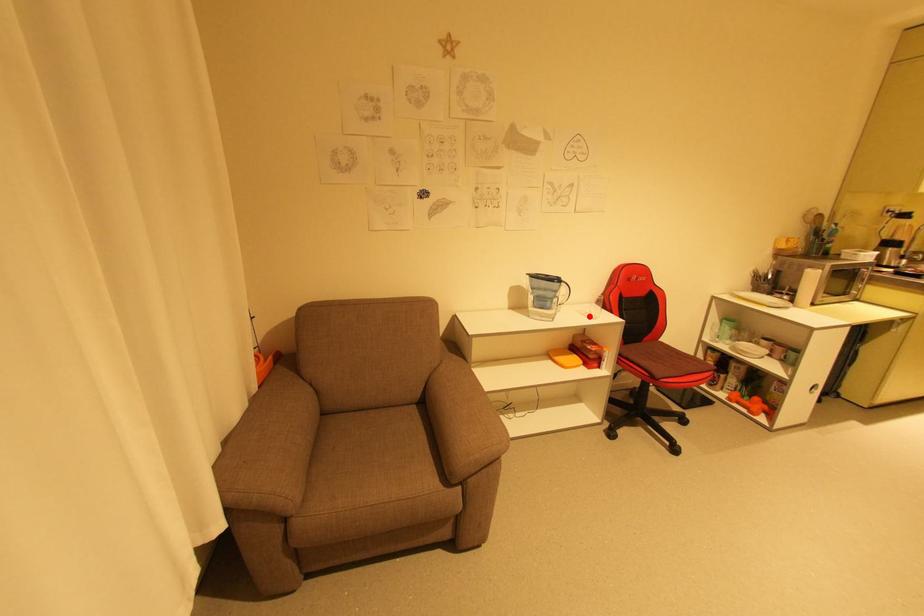
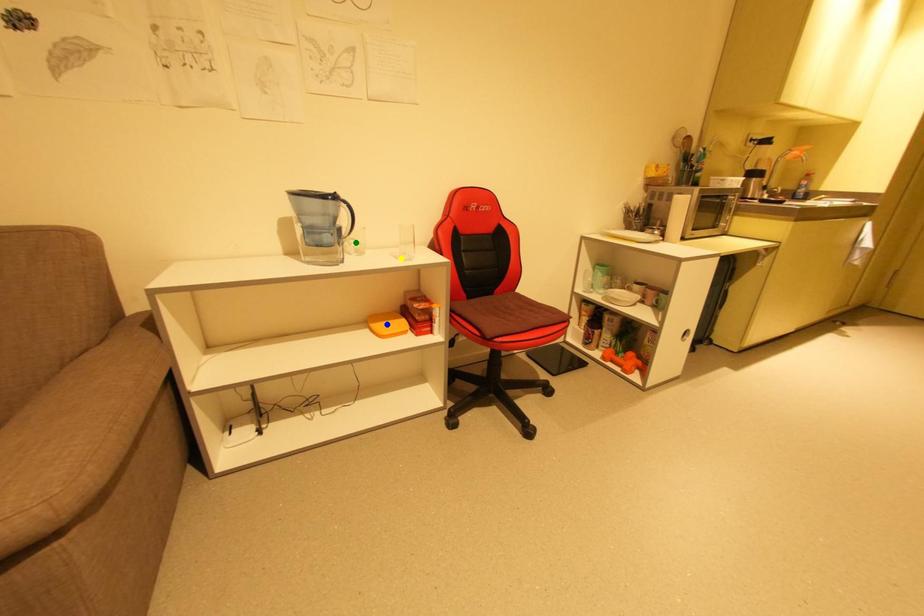
Question: I am providing you with two images of the same scene from different viewpoints. A red point is marked on the first image. You are given multiple points on the second image. In image 2, which mark is for the same physical point as the one in image 1?

Choices:
 (A) yellow point
 (B) blue point
 (C) green point

Answer: (A)